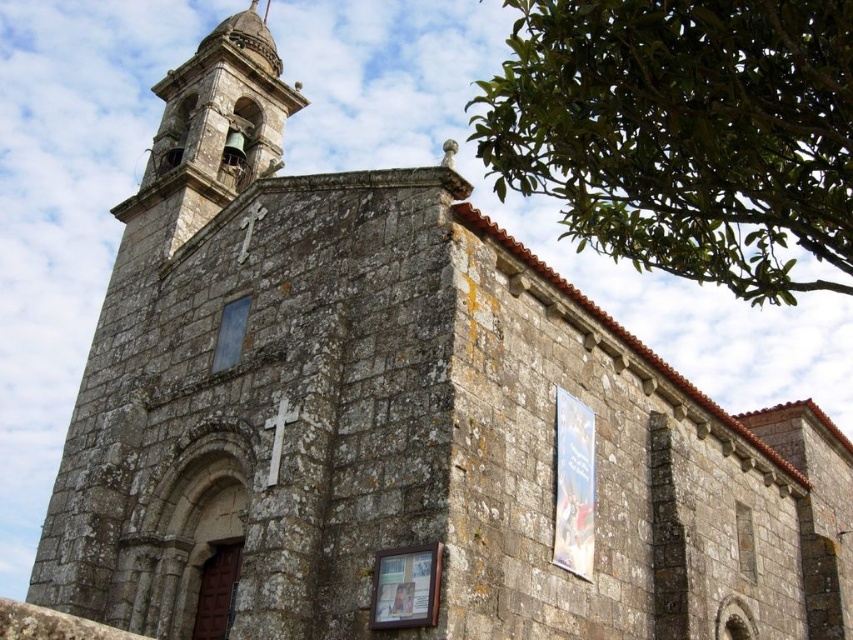
Question: Is green leafy tree at upper right thinner than rusty stone bell tower at upper left?

Choices:
 (A) yes
 (B) no

Answer: (B)

Question: Which object is closer to the camera taking this photo?

Choices:
 (A) green leafy tree at upper right
 (B) rusty stone bell tower at upper left

Answer: (A)

Question: Which object appears farthest from the camera in this image?

Choices:
 (A) rusty stone bell tower at upper left
 (B) green leafy tree at upper right

Answer: (A)

Question: Is green leafy tree at upper right wider than rusty stone bell tower at upper left?

Choices:
 (A) no
 (B) yes

Answer: (B)

Question: Is green leafy tree at upper right positioned at the back of rusty stone bell tower at upper left?

Choices:
 (A) no
 (B) yes

Answer: (A)